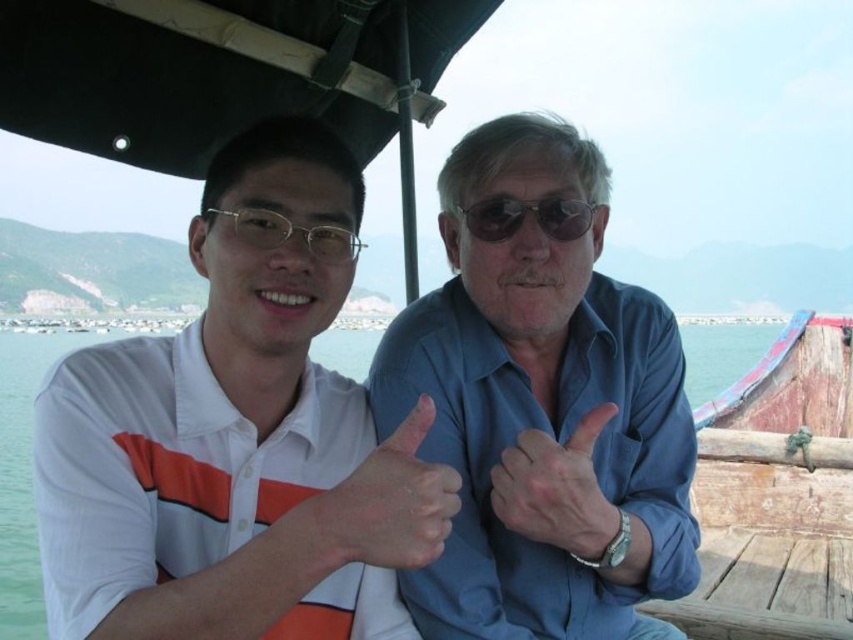
You are a photographer taking a picture of two people sitting under a boat canopy. You notice a smooth skin hand at center and sunglasses at center in the frame. Which object should you adjust to ensure both are clearly visible in the photo?

The smooth skin hand at center is much taller than the sunglasses at center, so you should lower the smooth skin hand at center or raise the sunglasses at center to ensure both are clearly visible in the photo.

You are a photographer trying to capture a candid shot of the two people under the canopy. You notice the white cotton shirt at center and the dry skin at center. Which object should you focus on first if you want to capture the person on the left?

You should focus on the white cotton shirt at center first because it is located to the left of the dry skin at center, which is part of the person on the left.

What are the coordinates of the smooth skin hand at center?

The smooth skin hand at center is located at point [556,490].